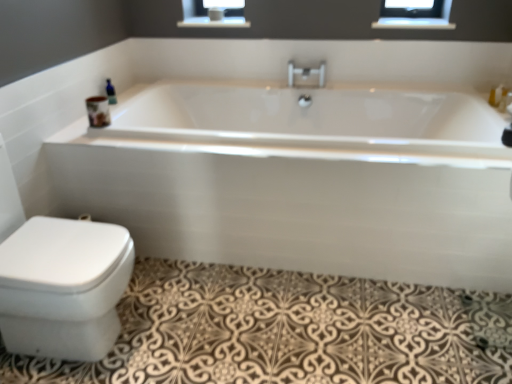
This screenshot has height=384, width=512. Find the location of `vacant area that lies to the right of white glossy bidet at lower left`. vacant area that lies to the right of white glossy bidet at lower left is located at coordinates (187, 334).